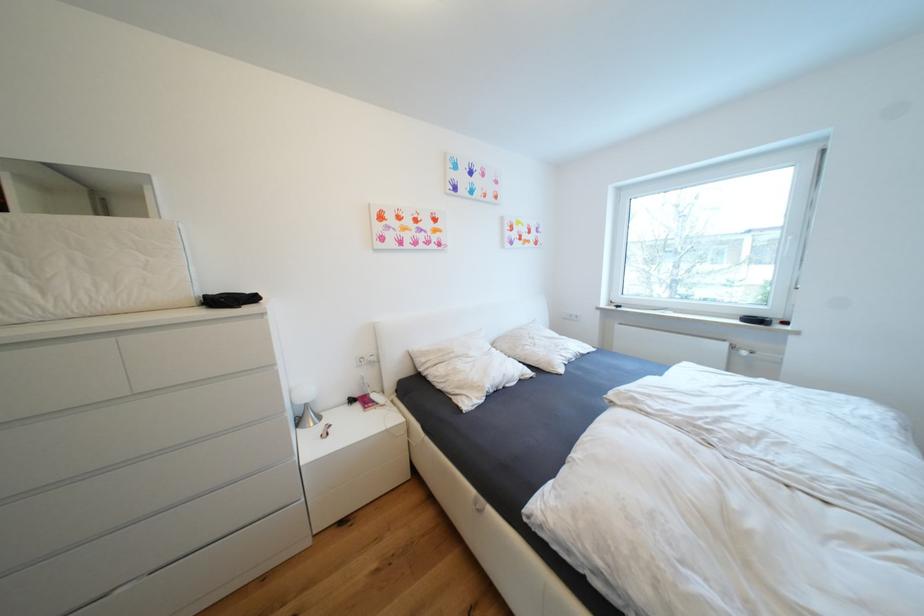
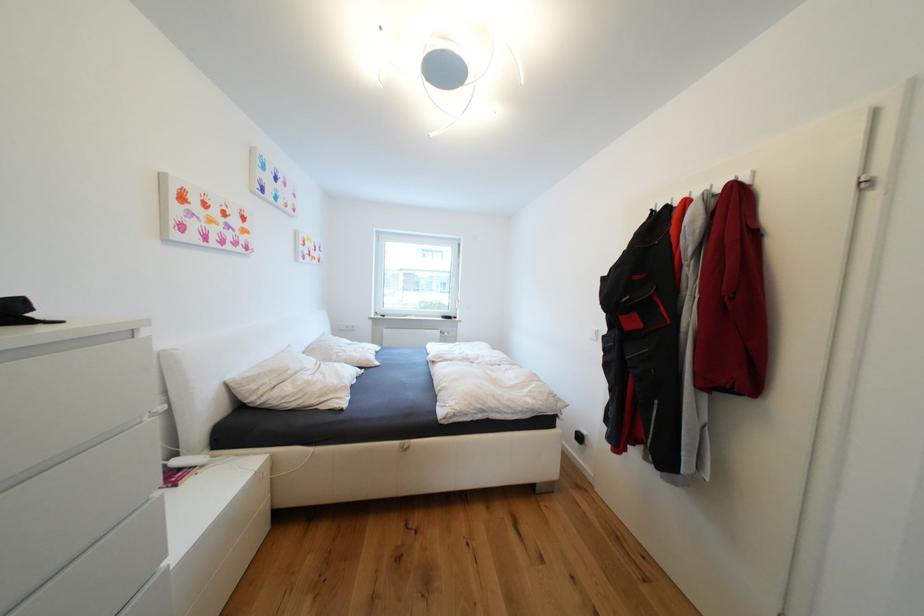
The point at (465, 359) is marked in the first image. Where is the corresponding point in the second image?

(304, 374)